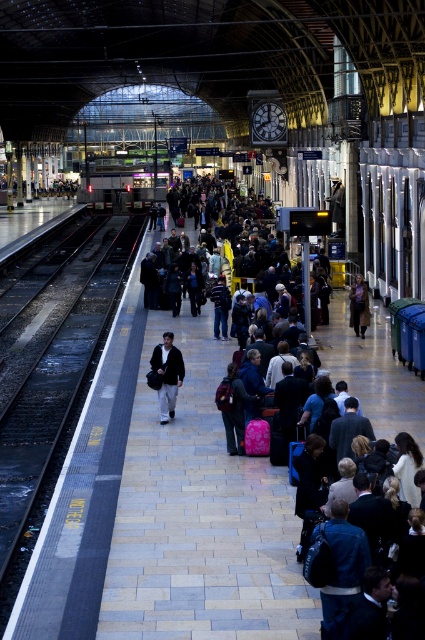
You are a photographer standing on the train station platform. You want to capture a photo of the dark brown leather jacket at center without the dark gray fabric crowd at center blocking it. Is the crowd too wide to avoid?

The dark gray fabric crowd at center is wider than the dark brown leather jacket at center, so it might be challenging to avoid the crowd blocking the jacket in your photo.

From the picture: You are a passenger waiting at the train station platform. You notice the black asphalt train track at left and the metallic silver train at center. Which object takes up more space in the image?

The metallic silver train at center takes up more space in the image than the black asphalt train track at left because the track occupies less space according to the description.

In the scene shown: You are a photographer standing on the train station platform. You want to take a clear photo of the dark brown leather jacket at center without the dark gray fabric crowd at center blocking it. What should you do?

The dark gray fabric crowd at center is much taller than the dark brown leather jacket at center, so you should move to a higher position to get a clear view of the dark brown leather jacket at center without obstruction from the crowd.